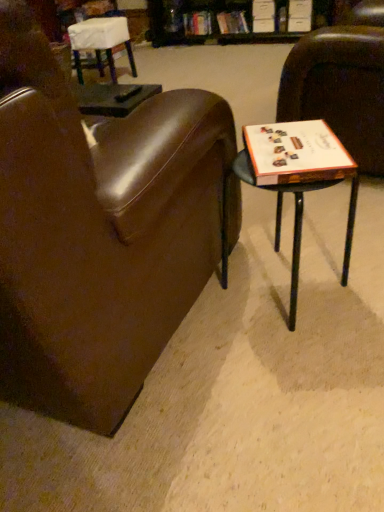
I want to click on blank area beneath wooden table at right (from a real-world perspective), so click(x=287, y=291).